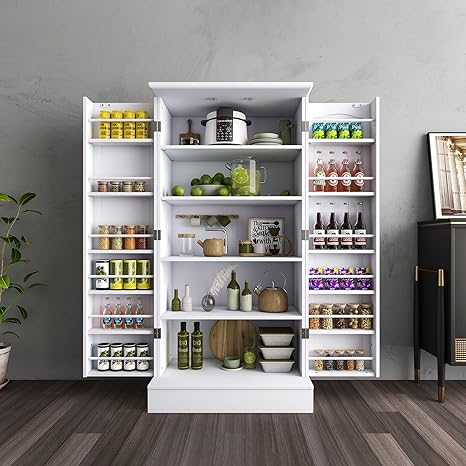
This screenshot has width=466, height=466. I want to click on white containers on bottom left shelf, so click(105, 363), click(117, 363), click(128, 363), click(143, 367).